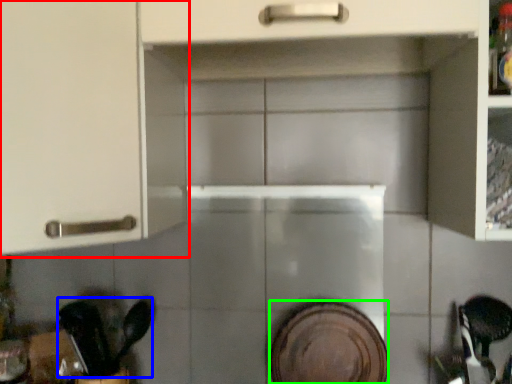
Question: Which object is positioned farthest from cabinetry (highlighted by a red box)? Select from tableware (highlighted by a blue box) and platter (highlighted by a green box).

Choices:
 (A) tableware
 (B) platter

Answer: (B)